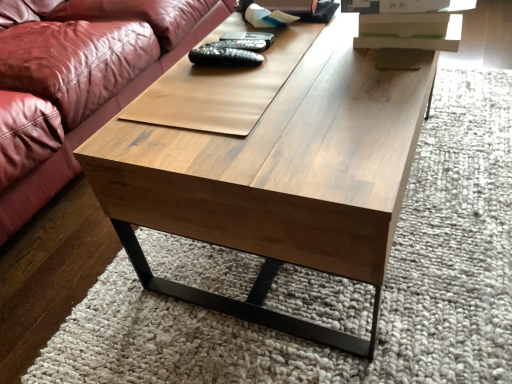
Question: From the image's perspective, is black matte remote at center, positioned as the first remote in bottom-to-top order, positioned above or below wooden coffee table at center?

Choices:
 (A) below
 (B) above

Answer: (B)

Question: Based on their positions, is black matte remote at center, the 3th remote when ordered from top to bottom, located to the left or right of wooden coffee table at center?

Choices:
 (A) right
 (B) left

Answer: (B)

Question: Estimate the real-world distances between objects in this image. Which object is farther from the black plastic remote at center, which ranks as the first remote in top-to-bottom order?

Choices:
 (A) wooden coffee table at center
 (B) black matte remote at center, the 3th remote when ordered from top to bottom
 (C) black matte remote at center, which ranks as the second remote in top-to-bottom order

Answer: (A)

Question: Based on their relative distances, which object is farther from the black matte remote at center, positioned as the second remote in bottom-to-top order?

Choices:
 (A) black matte remote at center, positioned as the first remote in bottom-to-top order
 (B) black plastic remote at center, which ranks as the first remote in top-to-bottom order
 (C) wooden coffee table at center

Answer: (C)